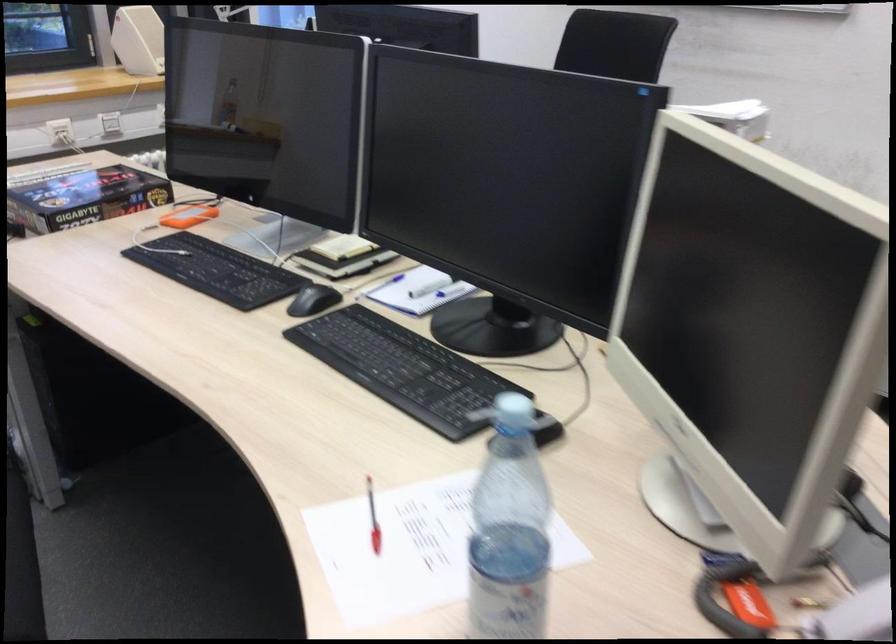
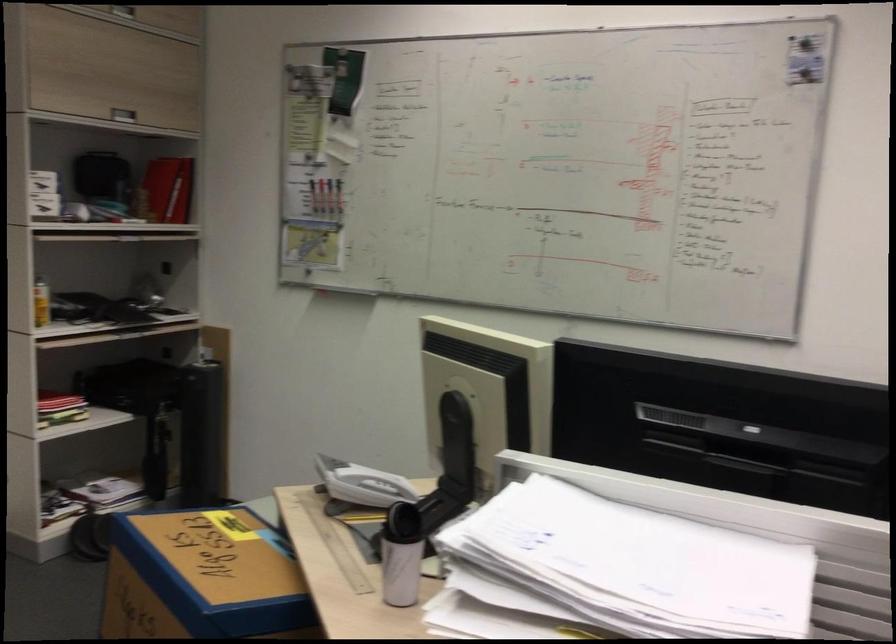
Question: I am providing you with two images of the same scene from different viewpoints. Please identify which objects are invisible in image2.

Choices:
 (A) phone handset
 (B) silver cabinet handle
 (C) black computer mouse
 (D) louvered cabinet door

Answer: (C)